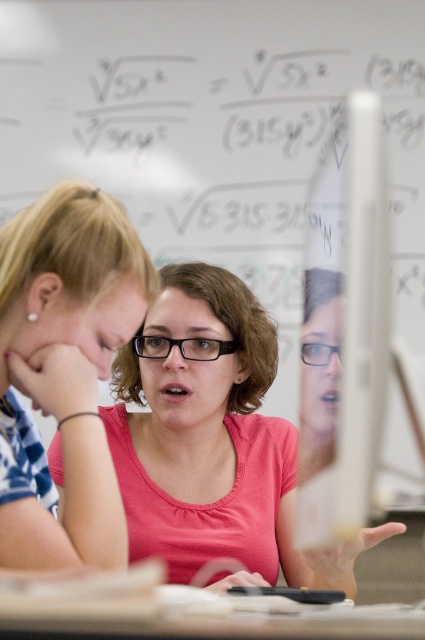
Question: Can you confirm if pink matte shirt at center is wider than pink matte shirt at upper left?

Choices:
 (A) yes
 (B) no

Answer: (A)

Question: Can you confirm if pink matte shirt at center is bigger than pink matte shirt at upper left?

Choices:
 (A) yes
 (B) no

Answer: (A)

Question: Which object is closer to the camera taking this photo?

Choices:
 (A) pink matte shirt at center
 (B) pink matte shirt at upper left

Answer: (B)

Question: Which point is farther to the camera?

Choices:
 (A) (88, 268)
 (B) (178, 384)

Answer: (B)

Question: Where is pink matte shirt at center located in relation to pink matte shirt at upper left in the image?

Choices:
 (A) right
 (B) left

Answer: (A)